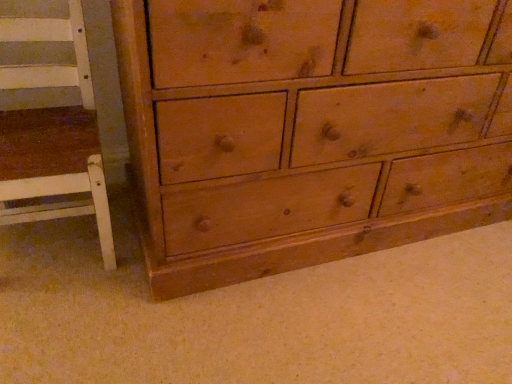
Find the location of a particular element. free spot in front of white wood armchair at left is located at coordinates (60, 323).